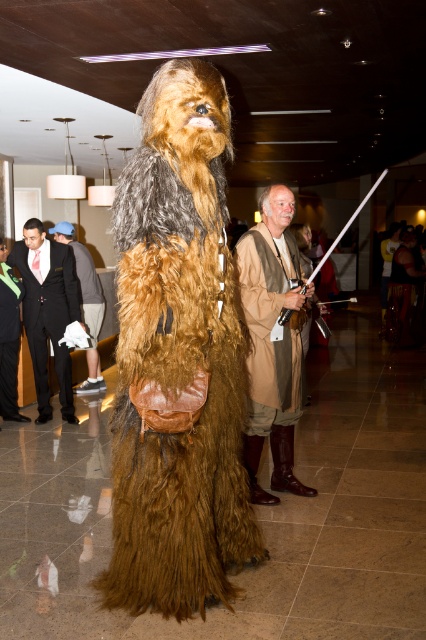
You are an event organizer planning to move a large banner between the black suit at left and dark gray suit at left. Based on their positions, can the banner be placed between them horizontally?

The black suit at left is below the dark gray suit at left, so they are vertically aligned. This means there is no horizontal space between them, so the banner cannot be placed between them horizontally.

Based on the photo, based on the coordinates provided, which object is located at point (178, 358) in the image?

The point (178, 358) marks the location of the brown furry costume at center.